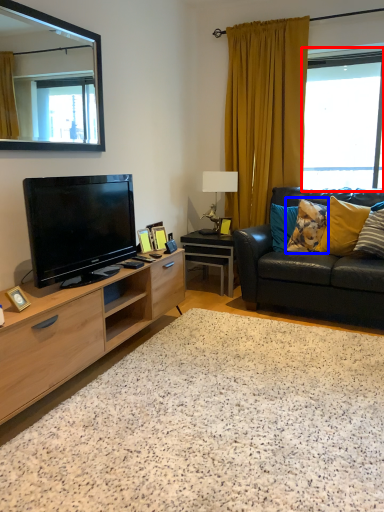
Question: Which object appears closest to the camera in this image, window (highlighted by a red box) or pillow (highlighted by a blue box)?

Choices:
 (A) window
 (B) pillow

Answer: (B)